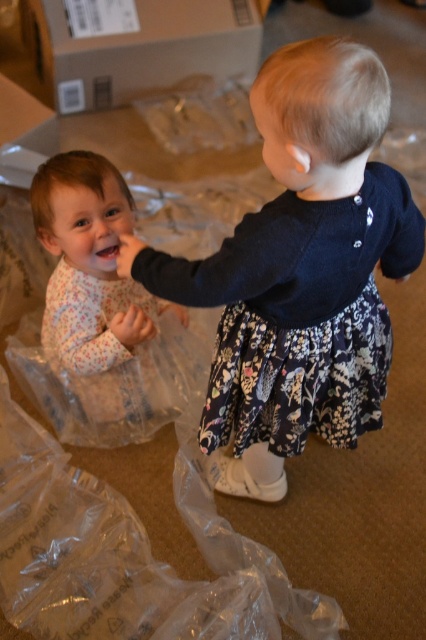
You are a parent trying to pack two outfits for a trip. You have a floral dress at left and floral pajamas at left. Which one takes up more space in your suitcase?

The floral dress at left is bigger than the floral pajamas at left, so it will take up more space in the suitcase.

You are a parent trying to pack two items into a small suitcase. You have the floral dress at left and the floral pajamas at left. Based on the image, which item is wider and would take up more space?

The floral dress at left is wider than the floral pajamas at left, so it would take up more space in the suitcase.

You are standing in the room and want to pick up an item located at point (x=307, y=204). If your arm can reach up to 36 inches, will you be able to reach it?

The distance between you and the point (x=307, y=204) is 37.99 inches, which is beyond your arm reach of 36 inches. Therefore, you cannot reach it.